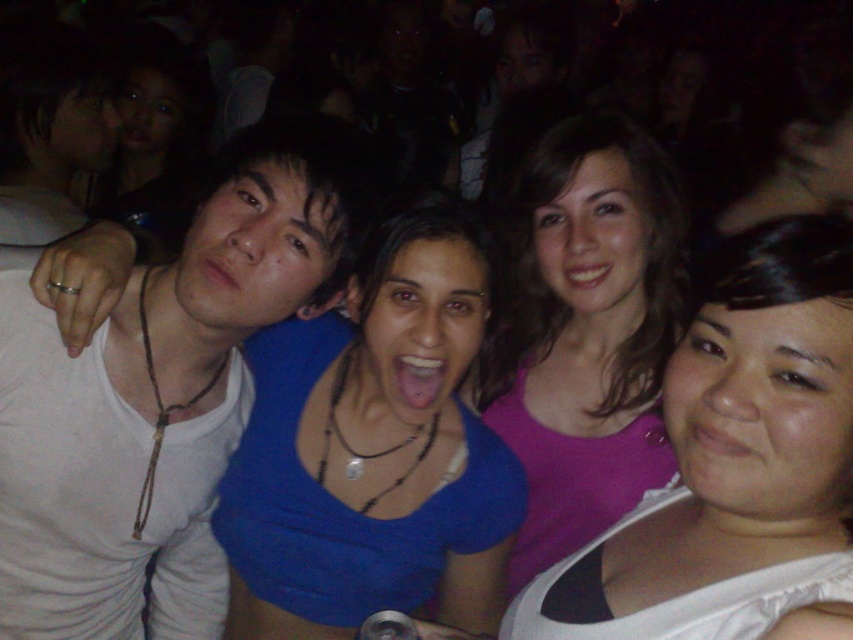
Question: Is blue fabric top at center below pink matte tank top at center?

Choices:
 (A) no
 (B) yes

Answer: (A)

Question: Does white matte tank top at left appear on the right side of purple matte tank top at center?

Choices:
 (A) no
 (B) yes

Answer: (A)

Question: Which object appears farthest from the camera in this image?

Choices:
 (A) white matte tank top at left
 (B) blue fabric top at center
 (C) pink matte tank top at center

Answer: (B)

Question: Which object is farther from the camera taking this photo?

Choices:
 (A) white matte tank top at left
 (B) pink matte tank top at center
 (C) blue fabric top at center

Answer: (C)

Question: Estimate the real-world distances between objects in this image. Which object is closer to the blue fabric top at center?

Choices:
 (A) pink matte tank top at center
 (B) purple matte tank top at center

Answer: (B)

Question: Is the position of white matte tank top at left less distant than that of pink matte tank top at center?

Choices:
 (A) yes
 (B) no

Answer: (B)